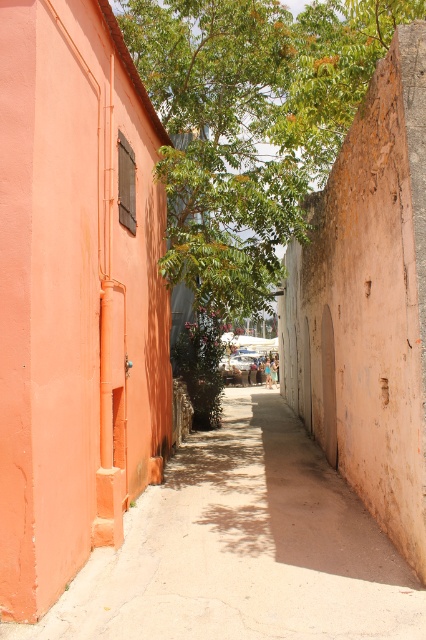
Question: Is smooth concrete path at center positioned before green leafy tree at upper center?

Choices:
 (A) yes
 (B) no

Answer: (A)

Question: Among these objects, which one is nearest to the camera?

Choices:
 (A) green leafy tree at upper center
 (B) smooth concrete path at center

Answer: (B)

Question: Which object is farther from the camera taking this photo?

Choices:
 (A) green leafy tree at upper center
 (B) smooth concrete path at center

Answer: (A)

Question: Is smooth concrete path at center bigger than green leafy tree at upper center?

Choices:
 (A) yes
 (B) no

Answer: (A)

Question: Is the position of smooth concrete path at center less distant than that of green leafy tree at upper center?

Choices:
 (A) no
 (B) yes

Answer: (B)